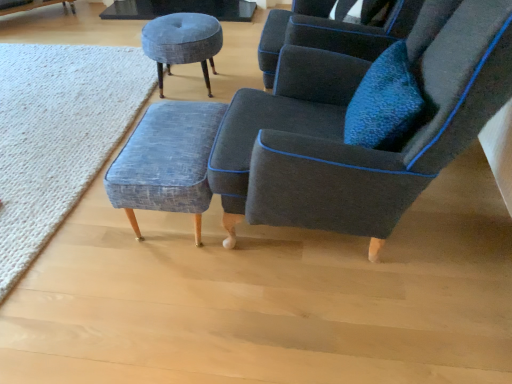
I want to click on vacant space that is to the left of dark gray fabric chair at center, so click(128, 291).